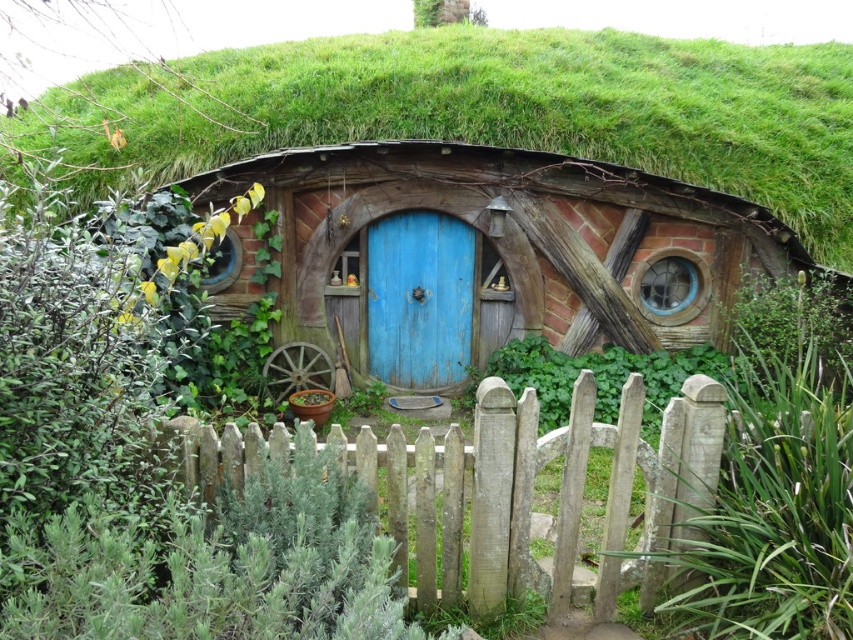
Between point (392, 442) and point (469, 253), which one is positioned behind?

The point (469, 253) is more distant.

Is weathered wood fence at center positioned in front of blue wooden door at center?

That is True.

Is point (422, 499) in front of point (410, 292)?

Yes, it is in front of point (410, 292).

At what (x,y) coordinates should I click in order to perform the action: click on weathered wood fence at center. Please return your answer as a coordinate pair (x, y). This screenshot has height=640, width=853. Looking at the image, I should click on (532, 493).

Which of these two, wooden door at center or weathered wood fence at center, stands shorter?

weathered wood fence at center is shorter.

Between wooden door at center and weathered wood fence at center, which one appears on the left side from the viewer's perspective?

weathered wood fence at center is more to the left.

Locate an element on the screen. The height and width of the screenshot is (640, 853). wooden door at center is located at coordinates (489, 257).

Is point (401, 74) in front of point (380, 380)?

That is False.

Does green grass at center have a larger size compared to blue wooden door at center?

Yes, green grass at center is bigger than blue wooden door at center.

What do you see at coordinates (509, 108) in the screenshot?
I see `green grass at center` at bounding box center [509, 108].

The width and height of the screenshot is (853, 640). I want to click on green grass at center, so click(x=509, y=108).